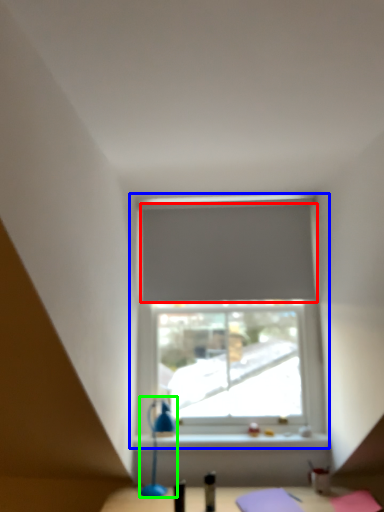
Question: Which object is the closest to the curtain (highlighted by a red box)? Choose among these: window (highlighted by a blue box) or table lamp (highlighted by a green box).

Choices:
 (A) window
 (B) table lamp

Answer: (A)